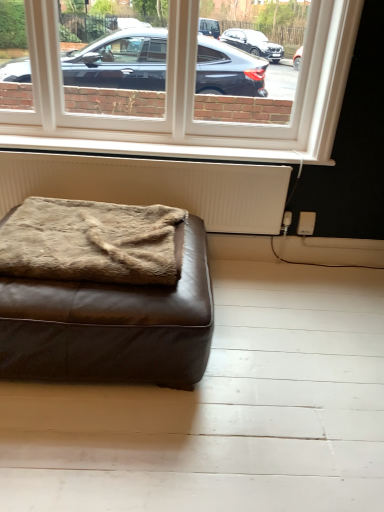
Where is `brown leather ottoman at lower left`? brown leather ottoman at lower left is located at coordinates point(111,326).

Find the location of a particular element. Image resolution: width=384 pixels, height=512 pixels. white plastic window at upper center is located at coordinates (190, 97).

This screenshot has width=384, height=512. What do you see at coordinates (92, 242) in the screenshot?
I see `brown fuzzy blanket at lower left` at bounding box center [92, 242].

This screenshot has height=512, width=384. Describe the element at coordinates (162, 150) in the screenshot. I see `white painted wood at lower center` at that location.

Image resolution: width=384 pixels, height=512 pixels. I want to click on brown leather ottoman at lower left, so click(111, 326).

Locate an element on the screen. This screenshot has width=384, height=512. radiator above the brown fuzzy blanket at lower left (from the image's perspective) is located at coordinates (154, 186).

Between white textured radiator at lower center and brown fuzzy blanket at lower left, which one appears on the left side from the viewer's perspective?

From the viewer's perspective, brown fuzzy blanket at lower left appears more on the left side.

Are white textured radiator at lower center and brown fuzzy blanket at lower left located far from each other?

That's not correct — white textured radiator at lower center is a little close to brown fuzzy blanket at lower left.

Is white textured radiator at lower center taller than brown fuzzy blanket at lower left?

Indeed, white textured radiator at lower center has a greater height compared to brown fuzzy blanket at lower left.

How many degrees apart are the facing directions of white painted wood at lower center and white plastic window at upper center?

The angular difference between white painted wood at lower center and white plastic window at upper center is 0.699 degrees.

Which object is wider, white painted wood at lower center or white plastic window at upper center?

white painted wood at lower center.

Is white painted wood at lower center located outside white plastic window at upper center?

Yes, white painted wood at lower center is located beyond the bounds of white plastic window at upper center.

From a real-world perspective, does white painted wood at lower center sit lower than white plastic window at upper center?

Indeed, from a real-world perspective, white painted wood at lower center is positioned beneath white plastic window at upper center.

Between brown fuzzy blanket at lower left and white painted wood at lower center, which one has larger size?

brown fuzzy blanket at lower left is bigger.

Based on the photo, from the image's perspective, which object appears higher, brown fuzzy blanket at lower left or white painted wood at lower center?

From the image's view, white painted wood at lower center is above.

Could you tell me if brown fuzzy blanket at lower left is facing white painted wood at lower center?

No, brown fuzzy blanket at lower left is not facing towards white painted wood at lower center.

Can you confirm if brown fuzzy blanket at lower left is shorter than white painted wood at lower center?

In fact, brown fuzzy blanket at lower left may be taller than white painted wood at lower center.

Based on their sizes in the image, would you say white textured radiator at lower center is bigger or smaller than white painted wood at lower center?

Considering their sizes, white textured radiator at lower center takes up more space than white painted wood at lower center.

From the picture: Is white textured radiator at lower center positioned beyond the bounds of white painted wood at lower center?

Indeed, white textured radiator at lower center is completely outside white painted wood at lower center.

Measure the distance between white textured radiator at lower center and white painted wood at lower center.

The distance of white textured radiator at lower center from white painted wood at lower center is 5.95 inches.

Is white textured radiator at lower center facing towards white plastic window at upper center?

No.

Considering the relative sizes of white textured radiator at lower center and white plastic window at upper center in the image provided, is white textured radiator at lower center bigger than white plastic window at upper center?

Actually, white textured radiator at lower center might be smaller than white plastic window at upper center.

Between white textured radiator at lower center and white plastic window at upper center, which one appears on the right side from the viewer's perspective?

From the viewer's perspective, white plastic window at upper center appears more on the right side.

Which of these two, white textured radiator at lower center or white plastic window at upper center, is thinner?

With smaller width is white plastic window at upper center.

From the image's perspective, is brown leather ottoman at lower left over white textured radiator at lower center?

No, from the image's perspective, brown leather ottoman at lower left is not above white textured radiator at lower center.

Is brown leather ottoman at lower left to the left of white textured radiator at lower center from the viewer's perspective?

Correct, you'll find brown leather ottoman at lower left to the left of white textured radiator at lower center.

Is brown leather ottoman at lower left oriented away from white textured radiator at lower center?

Yes, brown leather ottoman at lower left's orientation is away from white textured radiator at lower center.

Consider the image. Between brown leather ottoman at lower left and white textured radiator at lower center, which one has less height?

With less height is brown leather ottoman at lower left.

Is white textured radiator at lower center at the back of white painted wood at lower center?

No.

Considering the relative positions of white painted wood at lower center and white textured radiator at lower center in the image provided, is white painted wood at lower center behind white textured radiator at lower center?

Yes.

Visually, is white painted wood at lower center positioned to the left or to the right of white textured radiator at lower center?

Based on their positions, white painted wood at lower center is located to the right of white textured radiator at lower center.

Between white painted wood at lower center and white textured radiator at lower center, which one has smaller size?

With smaller size is white painted wood at lower center.

Locate an element on the screen. radiator that is on the right side of brown fuzzy blanket at lower left is located at coordinates (154, 186).

The height and width of the screenshot is (512, 384). Find the location of `window sill that is under the white plastic window at upper center (from a real-world perspective)`. window sill that is under the white plastic window at upper center (from a real-world perspective) is located at coordinates (162, 150).

Estimate the real-world distances between objects in this image. Which object is further from white painted wood at lower center, brown leather ottoman at lower left or white plastic window at upper center?

brown leather ottoman at lower left.

Estimate the real-world distances between objects in this image. Which object is closer to white textured radiator at lower center, brown leather ottoman at lower left or white painted wood at lower center?

white painted wood at lower center lies closer to white textured radiator at lower center than the other object.

From the image, which object appears to be farther from white painted wood at lower center, white textured radiator at lower center or brown leather ottoman at lower left?

brown leather ottoman at lower left is further to white painted wood at lower center.

When comparing their distances from white painted wood at lower center, does brown leather ottoman at lower left or white textured radiator at lower center seem closer?

Among the two, white textured radiator at lower center is located nearer to white painted wood at lower center.

From the image, which object appears to be farther from brown leather ottoman at lower left, brown fuzzy blanket at lower left or white painted wood at lower center?

white painted wood at lower center is further to brown leather ottoman at lower left.

From the image, which object appears to be nearer to white plastic window at upper center, brown fuzzy blanket at lower left or white textured radiator at lower center?

Among the two, white textured radiator at lower center is located nearer to white plastic window at upper center.

Estimate the real-world distances between objects in this image. Which object is closer to brown leather ottoman at lower left, white painted wood at lower center or white plastic window at upper center?

Among the two, white painted wood at lower center is located nearer to brown leather ottoman at lower left.

Considering their positions, is brown leather ottoman at lower left positioned closer to white painted wood at lower center than brown fuzzy blanket at lower left?

Among the two, brown fuzzy blanket at lower left is located nearer to white painted wood at lower center.

You are a GUI agent. You are given a task and a screenshot of the screen. Output one action in this format:
    pyautogui.click(x=<x>, y=<y>)
    Task: Click on the radiator positioned between brown fuzzy blanket at lower left and white painted wood at lower center from near to far
    This screenshot has width=384, height=512.
    Given the screenshot: What is the action you would take?
    pyautogui.click(x=154, y=186)

In order to click on blanket positioned between brown leather ottoman at lower left and white painted wood at lower center from near to far in this screenshot , I will do `click(92, 242)`.

At what (x,y) coordinates should I click in order to perform the action: click on window sill that lies between white plastic window at upper center and white textured radiator at lower center from top to bottom. Please return your answer as a coordinate pair (x, y). Looking at the image, I should click on (162, 150).

Where is `window sill between white plastic window at upper center and brown fuzzy blanket at lower left in the vertical direction`? This screenshot has height=512, width=384. window sill between white plastic window at upper center and brown fuzzy blanket at lower left in the vertical direction is located at coordinates (162, 150).